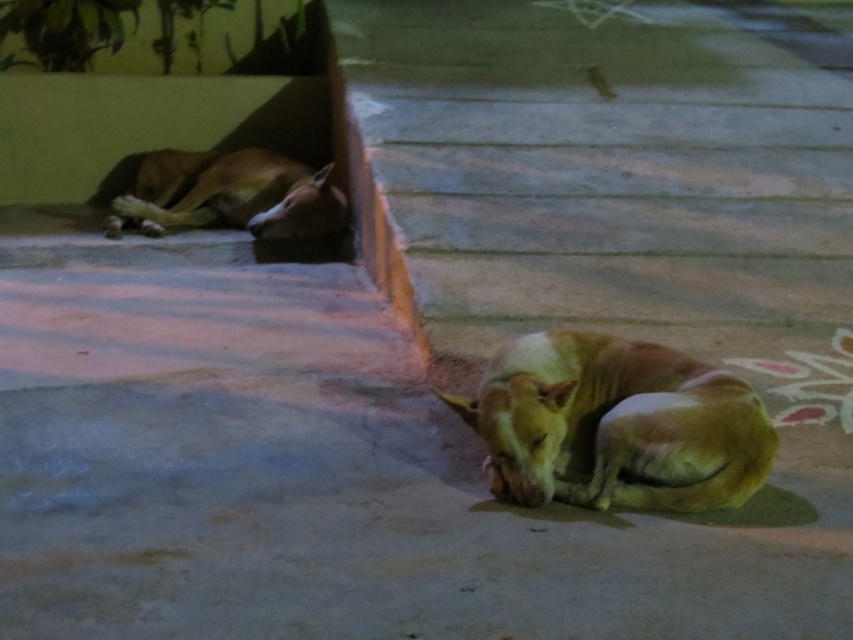
Question: Is gray concrete pavement at center to the right of golden fur dog at lower right from the viewer's perspective?

Choices:
 (A) no
 (B) yes

Answer: (A)

Question: Is gray concrete pavement at center smaller than golden fur dog at lower right?

Choices:
 (A) no
 (B) yes

Answer: (A)

Question: Which of the following is the closest to the observer?

Choices:
 (A) (323, 515)
 (B) (643, 440)
 (C) (193, 209)

Answer: (A)

Question: Which point is closer to the camera?

Choices:
 (A) (669, 506)
 (B) (688, 563)

Answer: (B)

Question: Is gray concrete pavement at center bigger than golden fur dog at lower right?

Choices:
 (A) yes
 (B) no

Answer: (A)

Question: Estimate the real-world distances between objects in this image. Which object is farther from the golden fur dog at lower right?

Choices:
 (A) brown furry dog at upper left
 (B) gray concrete pavement at center

Answer: (A)